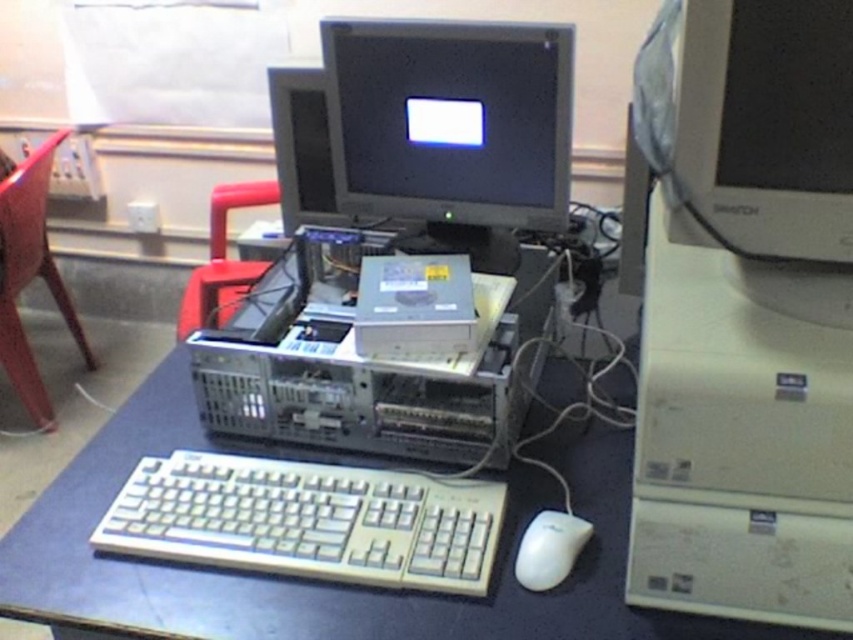
Between point (444, 506) and point (218, 208), which one is positioned behind?

The point (218, 208) is behind.

Image resolution: width=853 pixels, height=640 pixels. I want to click on white plastic keyboard at lower center, so click(308, 520).

Does metallic red chair at upper center appear on the right side of white matte mouse at lower right?

No, metallic red chair at upper center is not to the right of white matte mouse at lower right.

Who is positioned more to the right, metallic red chair at upper center or white matte mouse at lower right?

Positioned to the right is white matte mouse at lower right.

Image resolution: width=853 pixels, height=640 pixels. In order to click on metallic red chair at upper center in this screenshot , I will do `click(223, 260)`.

Locate an element on the screen. metallic red chair at upper center is located at coordinates (223, 260).

Who is positioned more to the right, red plastic chair at left or metallic red chair at upper center?

From the viewer's perspective, metallic red chair at upper center appears more on the right side.

Is point (24, 193) positioned before point (181, 300)?

Yes.

This screenshot has width=853, height=640. Find the location of `red plastic chair at left`. red plastic chair at left is located at coordinates (28, 273).